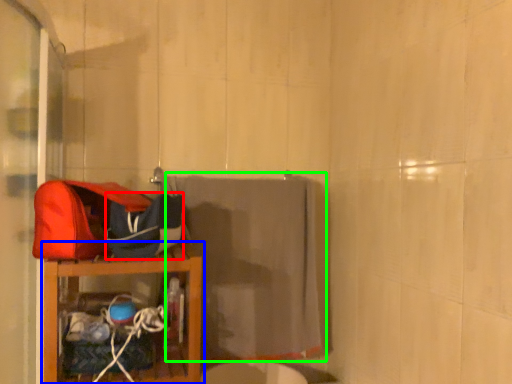
Question: Which is nearer to the kit (highlighted by a red box)? furniture (highlighted by a blue box) or bath towel (highlighted by a green box).

Choices:
 (A) furniture
 (B) bath towel

Answer: (A)